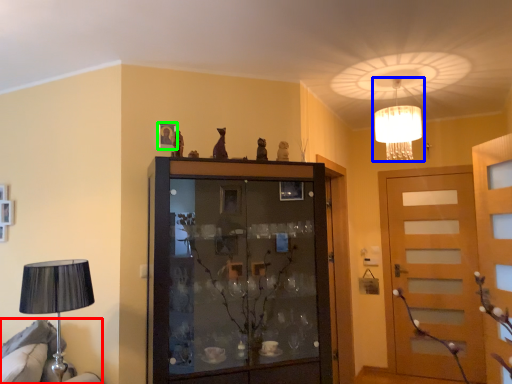
Question: Considering the real-world distances, which object is closest to furniture (highlighted by a red box)? lamp (highlighted by a blue box) or picture frame (highlighted by a green box).

Choices:
 (A) lamp
 (B) picture frame

Answer: (B)